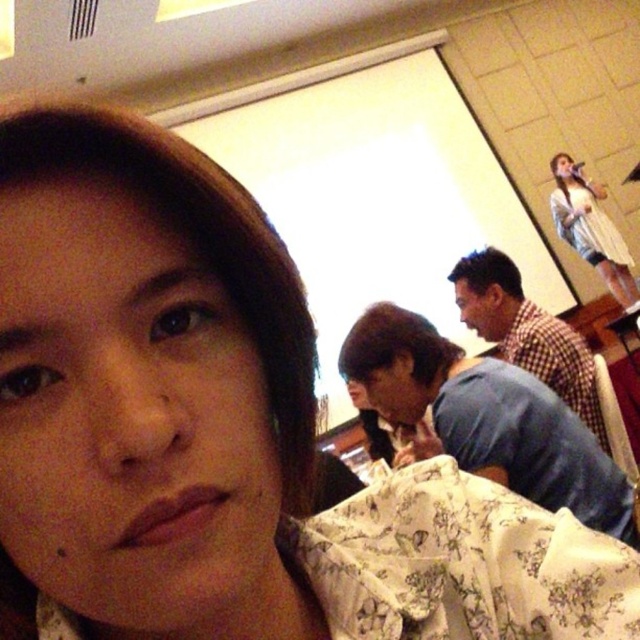
Based on the photo, you are at a social event and want to take a photo of the floral fabric at center and the white sheer dress at upper right. Which object should you focus on first if you want to capture both in the same frame without moving your camera?

The floral fabric at center has a lesser height compared to white sheer dress at upper right, so you should focus on the white sheer dress at upper right first since it is taller and might require adjusting the camera angle to include both in the frame.

You are at a social event and want to take a photo of the white sheer dress at upper right without including the floral fabric at center. Based on their positions, is this possible?

The floral fabric at center is located below the white sheer dress at upper right, so if you position your camera to capture the white sheer dress at upper right while avoiding the lower area where the floral fabric at center is, it should be possible to take the photo without including it.